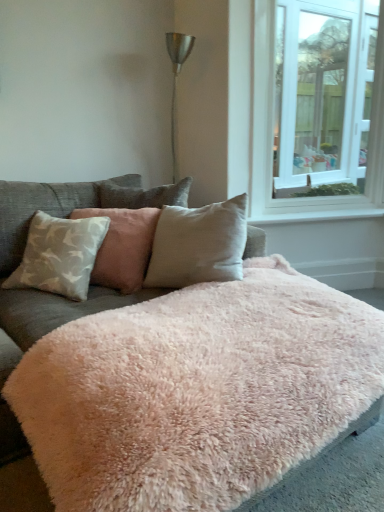
Question: Does white smooth window sill at upper right appear on the right side of light beige fabric pillow at center, marked as the 1th pillow in a right-to-left arrangement?

Choices:
 (A) no
 (B) yes

Answer: (B)

Question: Considering the relative sizes of white smooth window sill at upper right and light beige fabric pillow at center, marked as the 1th pillow in a right-to-left arrangement, in the image provided, is white smooth window sill at upper right thinner than light beige fabric pillow at center, marked as the 1th pillow in a right-to-left arrangement,?

Choices:
 (A) no
 (B) yes

Answer: (B)

Question: Considering the relative positions of white smooth window sill at upper right and light beige fabric pillow at center, which is the 2th pillow in left-to-right order, in the image provided, is white smooth window sill at upper right to the left of light beige fabric pillow at center, which is the 2th pillow in left-to-right order, from the viewer's perspective?

Choices:
 (A) yes
 (B) no

Answer: (B)

Question: Does white smooth window sill at upper right have a lesser height compared to light beige fabric pillow at center, marked as the 1th pillow in a right-to-left arrangement?

Choices:
 (A) yes
 (B) no

Answer: (A)

Question: Does white smooth window sill at upper right lie in front of light beige fabric pillow at center, which is the 2th pillow in left-to-right order?

Choices:
 (A) no
 (B) yes

Answer: (A)

Question: Is fluffy pink blanket at center taller or shorter than light beige fabric pillow at center, which is the 2th pillow in left-to-right order?

Choices:
 (A) tall
 (B) short

Answer: (A)

Question: Looking at their shapes, would you say fluffy pink blanket at center is wider or thinner than light beige fabric pillow at center, which is the 2th pillow in left-to-right order?

Choices:
 (A) wide
 (B) thin

Answer: (A)

Question: From the image's perspective, is fluffy pink blanket at center above or below light beige fabric pillow at center, which is the 2th pillow in left-to-right order?

Choices:
 (A) below
 (B) above

Answer: (A)

Question: Is fluffy pink blanket at center situated inside light beige fabric pillow at center, marked as the 1th pillow in a right-to-left arrangement, or outside?

Choices:
 (A) outside
 (B) inside

Answer: (A)

Question: Would you say white smooth window sill at upper right is inside or outside fluffy pink blanket at center?

Choices:
 (A) inside
 (B) outside

Answer: (B)

Question: Does point (299, 219) appear closer or farther from the camera than point (104, 295)?

Choices:
 (A) farther
 (B) closer

Answer: (A)

Question: In the image, is white smooth window sill at upper right positioned in front of or behind fluffy pink blanket at center?

Choices:
 (A) behind
 (B) front

Answer: (A)

Question: Considering the positions of white smooth window sill at upper right and fluffy pink blanket at center in the image, is white smooth window sill at upper right taller or shorter than fluffy pink blanket at center?

Choices:
 (A) tall
 (B) short

Answer: (B)

Question: Visually, is white glass window at upper right positioned to the left or to the right of white smooth window sill at upper right?

Choices:
 (A) right
 (B) left

Answer: (A)

Question: Is white glass window at upper right inside the boundaries of white smooth window sill at upper right, or outside?

Choices:
 (A) inside
 (B) outside

Answer: (B)